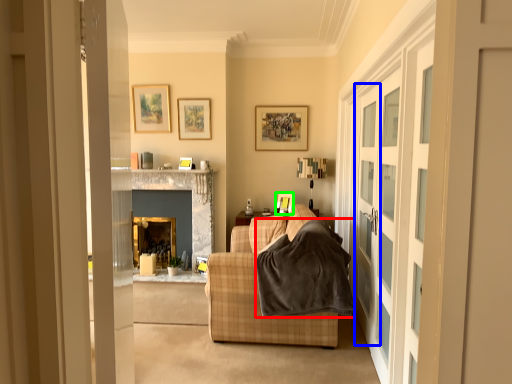
Question: Based on their relative distances, which object is farther from blanket (highlighted by a red box)? Choose from screen door (highlighted by a blue box) and picture frame (highlighted by a green box).

Choices:
 (A) screen door
 (B) picture frame

Answer: (B)